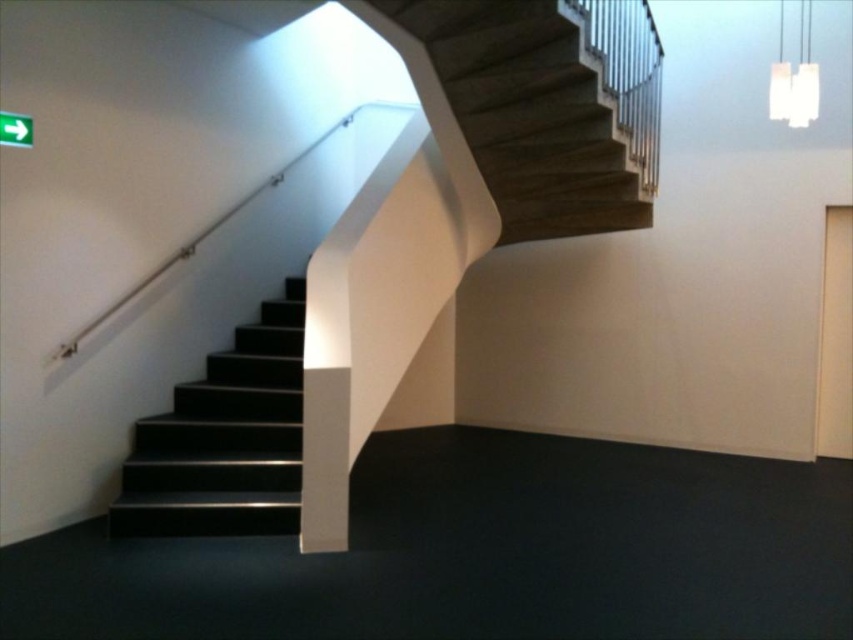
Question: Which object appears closest to the camera in this image?

Choices:
 (A) black glossy stairs at left
 (B) dark wood stairs at upper center

Answer: (B)

Question: Does dark wood stairs at upper center appear over black glossy stairs at left?

Choices:
 (A) no
 (B) yes

Answer: (B)

Question: Can you confirm if dark wood stairs at upper center is positioned below black glossy stairs at left?

Choices:
 (A) yes
 (B) no

Answer: (B)

Question: Which object appears closest to the camera in this image?

Choices:
 (A) dark wood stairs at upper center
 (B) black glossy stairs at left

Answer: (A)

Question: Can you confirm if dark wood stairs at upper center is wider than black glossy stairs at left?

Choices:
 (A) no
 (B) yes

Answer: (B)